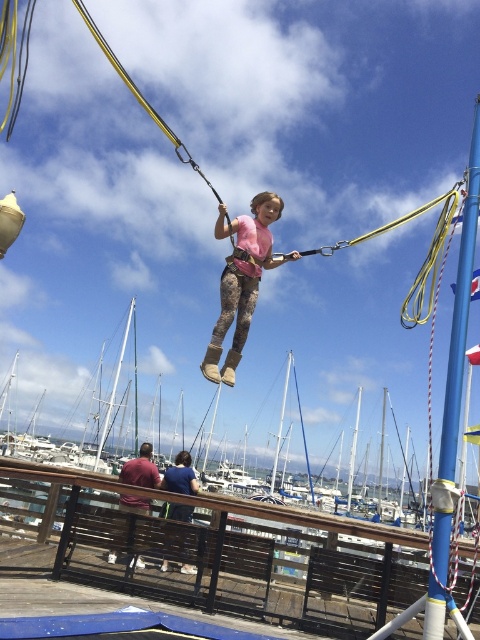
Can you confirm if brown wooden dock at lower center is thinner than blue painted metal pole at right?

No, brown wooden dock at lower center is not thinner than blue painted metal pole at right.

Between point (201, 602) and point (425, 625), which one is positioned in front?

Point (425, 625) is in front.

Identify the location of brown wooden dock at lower center. (216, 556).

Does blue painted metal pole at right appear over camouflage leggings at center?

Incorrect, blue painted metal pole at right is not positioned above camouflage leggings at center.

Is blue painted metal pole at right closer to camera compared to camouflage leggings at center?

Yes, blue painted metal pole at right is in front of camouflage leggings at center.

Between point (468, 294) and point (225, 269), which one is positioned behind?

Point (225, 269)

Where is `blue painted metal pole at right`? The image size is (480, 640). blue painted metal pole at right is located at coordinates (453, 400).

Who is more distant from viewer, (308, 576) or (276, 216)?

The point (276, 216) is behind.

Who is more forward, (x=129, y=532) or (x=228, y=381)?

Point (x=228, y=381) is more forward.

Between point (269, 564) and point (249, 252), which one is positioned behind?

Positioned behind is point (249, 252).

Locate an element on the screen. The width and height of the screenshot is (480, 640). brown wooden dock at lower center is located at coordinates (216, 556).